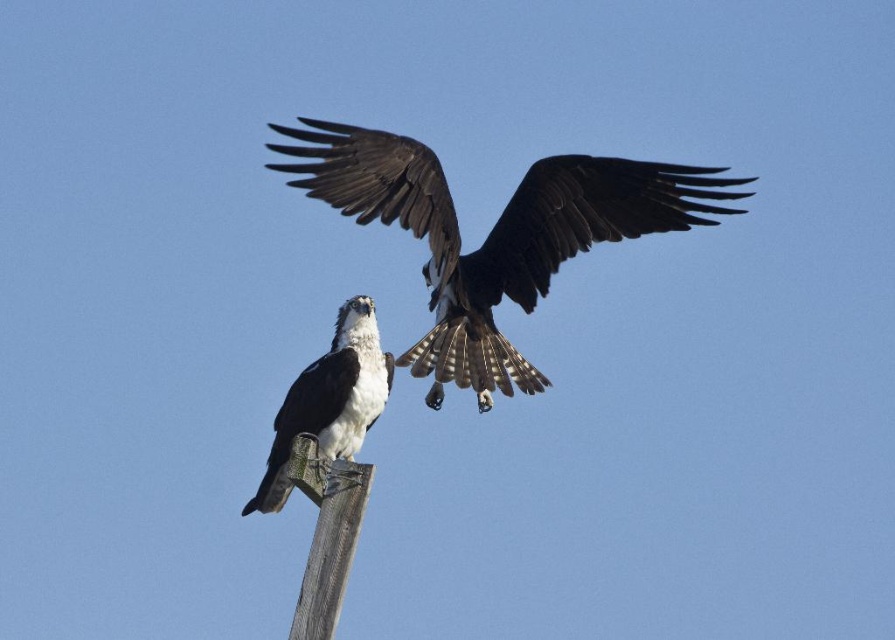
You are a photographer trying to capture both ospreys in a single shot. The ospreys are located at point (390, 216) and point (314, 433). Since you want to ensure both are in focus, which point should you focus on first to make sure the closer osprey is sharp?

You should focus on point (390, 216) first because it is closer to the camera than point (314, 433), ensuring the closer osprey is in sharp focus.

You are a photographer trying to capture both ospreys in a single shot. The osprey at point (374, 170) and the one at point (327, 536) are in different positions. Which osprey is closer to the camera?

The osprey at point (374, 170) is closer to the camera than the one at point (327, 536) because point (374, 170) is further to the camera than point (327, 536).